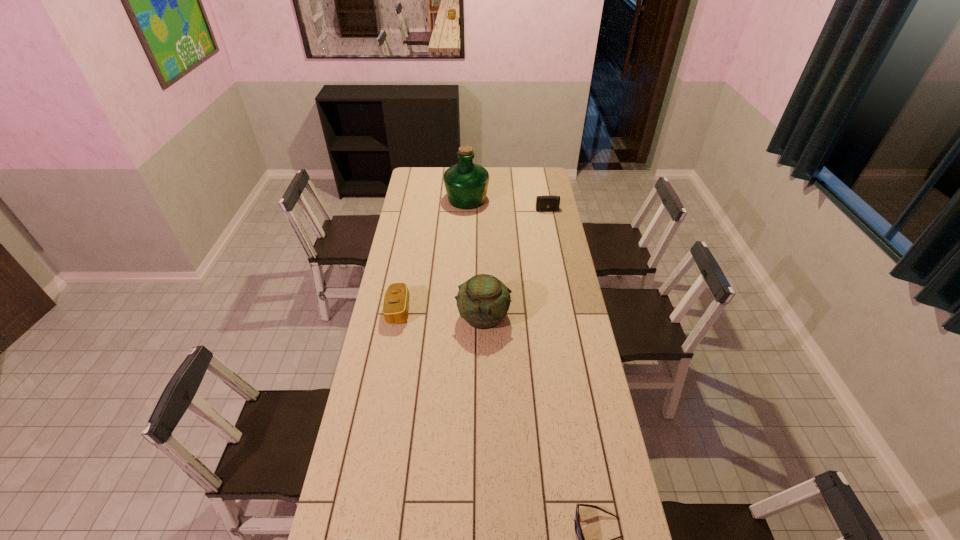
Where is `free space that satisfies the following two spatial constraints: 1. on the back side of the fifth shortest object; 2. on the zipper side of the left clutch bag`? This screenshot has width=960, height=540. free space that satisfies the following two spatial constraints: 1. on the back side of the fifth shortest object; 2. on the zipper side of the left clutch bag is located at coordinates (483, 310).

Locate an element on the screen. free region that satisfies the following two spatial constraints: 1. on the back side of the fifth shortest object; 2. on the zipper side of the nearer clutch bag is located at coordinates (483, 310).